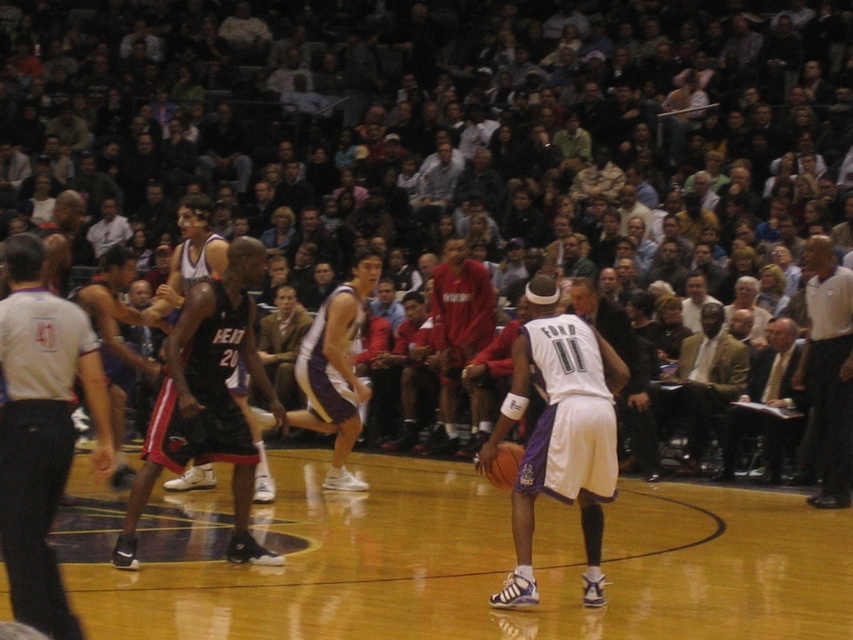
You are a photographer at the basketball game and want to take a photo that includes both the dark clothing crowd at center and the white shirt at upper right. Which object should you zoom in on to make sure both are visible in the frame?

To include both the dark clothing crowd at center and the white shirt at upper right in the photo, you should zoom out because the dark clothing crowd at center is bigger than the white shirt at upper right, so zooming out will ensure both fit in the frame.

What is the exact coordinate of the white matte jersey at center?

The white matte jersey at center is located at point (560,435).

You are a spectator sitting in the front row of the basketball court. You notice a point marked at coordinates [624,371] on the court. If the court is 94 feet long and 50 feet wide, can you estimate whether this point is closer to the baseline or the free throw line?

The point is 29.13 feet away from the viewer. Since the court is 94 feet long, the baseline is at 0 feet and the free throw line is around 15 feet from the baseline. If the viewer is at one end, the point at 29.13 feet would be closer to the free throw line than the baseline.